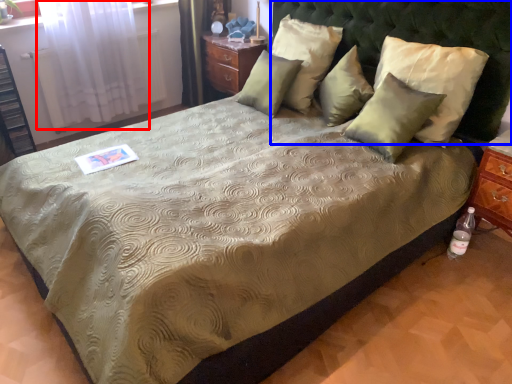
Question: Which object appears closest to the camera in this image, curtain (highlighted by a red box) or headboard (highlighted by a blue box)?

Choices:
 (A) curtain
 (B) headboard

Answer: (B)